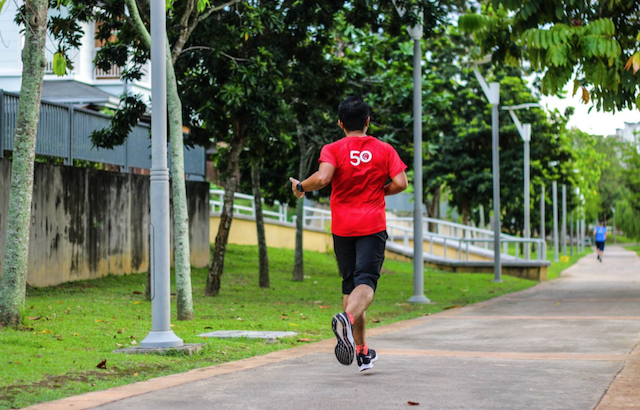
Find the location of a particular element. This screenshot has height=410, width=640. sock is located at coordinates (362, 350), (351, 319).